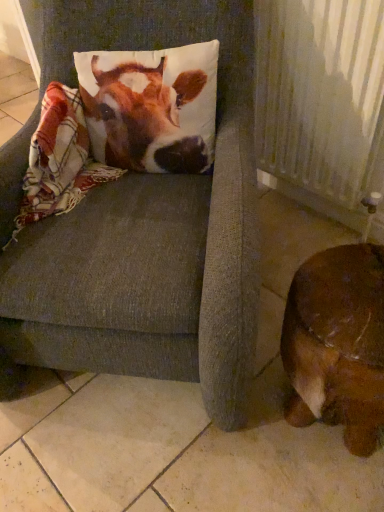
Question: From a real-world perspective, relative to brown leather dog at lower right, is textured gray cushion at center vertically above or below?

Choices:
 (A) above
 (B) below

Answer: (A)

Question: Considering the positions of textured gray cushion at center and brown leather dog at lower right in the image, is textured gray cushion at center taller or shorter than brown leather dog at lower right?

Choices:
 (A) short
 (B) tall

Answer: (B)

Question: Estimate the real-world distances between objects in this image. Which object is closer to the brown leather dog at lower right?

Choices:
 (A) textured gray cushion at center
 (B) white textured radiator at right
 (C) printed fabric pillow at upper left

Answer: (A)

Question: Based on their relative distances, which object is farther from the printed fabric pillow at upper left?

Choices:
 (A) textured gray cushion at center
 (B) brown leather dog at lower right
 (C) white textured radiator at right

Answer: (B)